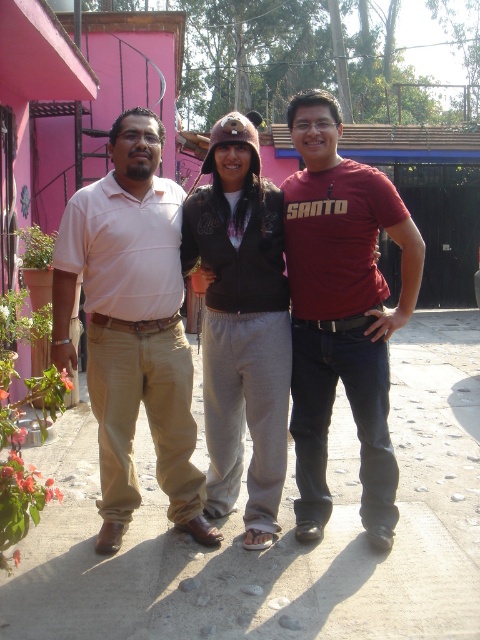
Is the position of light brown cotton pants at left more distant than that of maroon cotton shirt at center?

No, it is not.

This screenshot has width=480, height=640. I want to click on light brown cotton pants at left, so click(132, 326).

Does maroon cotton shirt at center have a greater width compared to matte brown jacket at center?

No, maroon cotton shirt at center is not wider than matte brown jacket at center.

Does point (359, 323) come closer to viewer compared to point (363, 317)?

No, (359, 323) is behind (363, 317).

This screenshot has width=480, height=640. Find the location of `maroon cotton shirt at center`. maroon cotton shirt at center is located at coordinates click(x=342, y=312).

Between light brown cotton pants at left and matte brown jacket at center, which one is positioned higher?

matte brown jacket at center is above.

Which of these two, light brown cotton pants at left or matte brown jacket at center, stands taller?

matte brown jacket at center is taller.

Describe the element at coordinates (132, 326) in the screenshot. I see `light brown cotton pants at left` at that location.

Identify the location of light brown cotton pants at left. The image size is (480, 640). (132, 326).